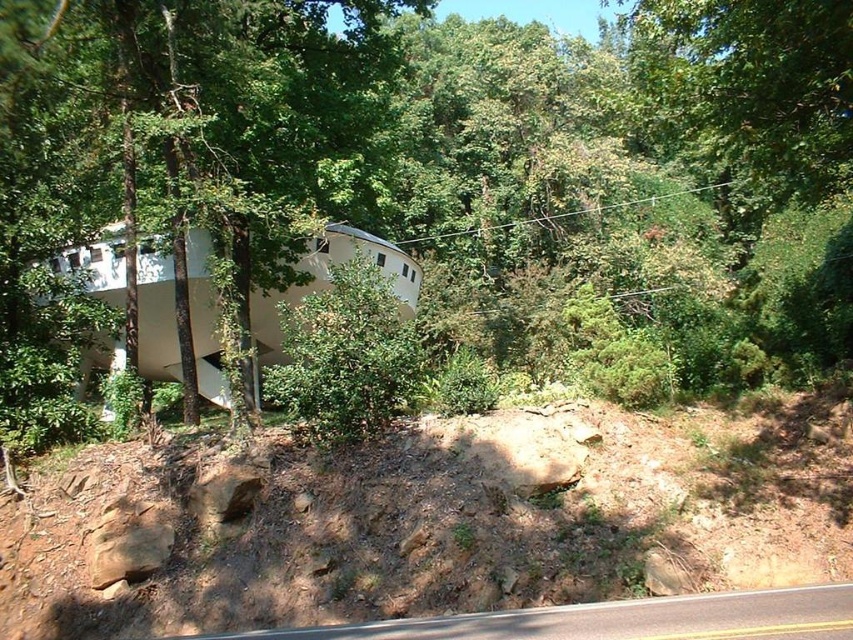
You are standing in front of the architectural structure and want to walk towards the green leafy tree at center. Which direction should you move relative to the dull brown dirt at lower center?

You should move towards the green leafy tree at center, which is closer to you than the dull brown dirt at lower center, so you don not need to go past the dull brown dirt at lower center to reach it.

Looking at this image, you are standing at the entrance of the building and want to walk towards the green leafy tree at center. Which direction should you turn to avoid stepping on the dull brown dirt at lower center?

The green leafy tree at center is to the right of the dull brown dirt at lower center, so you should turn to your left to avoid stepping on the dull brown dirt at lower center and head towards the tree.

You are standing at the point marked as point (692,172) in the image. A new hiking trail is being planned that requires a straight path from your current position to the nearest forest ranger station located 100 feet away. Is the distance from your current position to the nearest forest ranger station within the required limit?

The distance from point (692,172) to the viewer is 112.20 feet, which exceeds the 100 feet requirement. Therefore, the distance is not within the required limit.